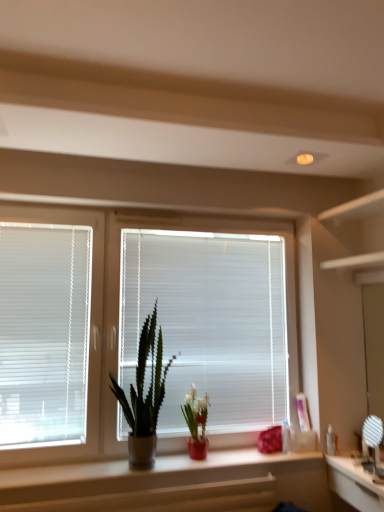
Where is `vacant space situated above white plastic blinds at center, marked as the second window blind in a left-to-right arrangement (from a real-world perspective)`? This screenshot has width=384, height=512. vacant space situated above white plastic blinds at center, marked as the second window blind in a left-to-right arrangement (from a real-world perspective) is located at coordinates (215, 233).